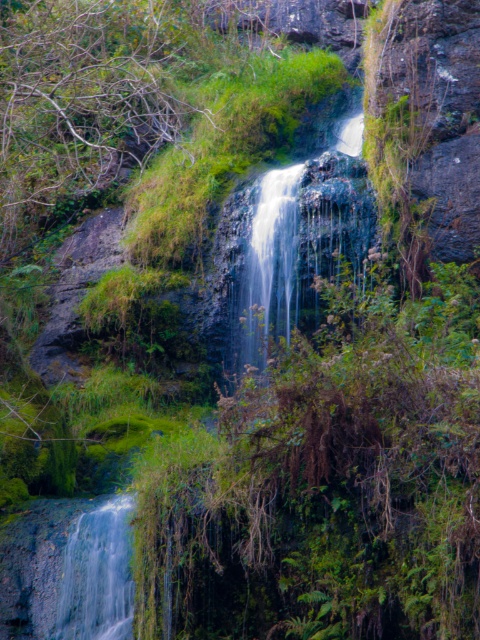
You are a hiker who wants to cross the clear water at bottom left to reach the other side. However, you need to avoid the translucent glass waterfall at center. Which path should you take to stay safe?

The translucent glass waterfall at center might be wider than clear water at bottom left, so you should avoid the area near the translucent glass waterfall at center and cross the clear water at bottom left instead.

What are the coordinates of the translucent glass waterfall at center?

The translucent glass waterfall at center is located at point (x=286, y=248).